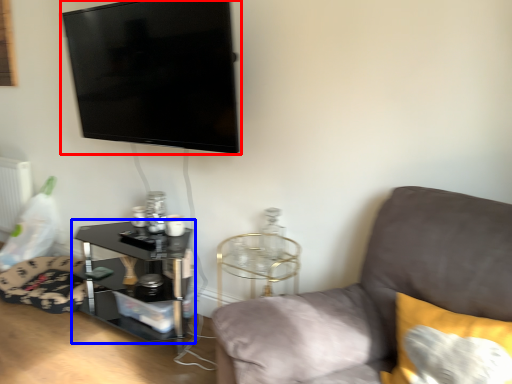
Question: Which point is closer to the camera, television (highlighted by a red box) or table (highlighted by a blue box)?

Choices:
 (A) television
 (B) table

Answer: (A)